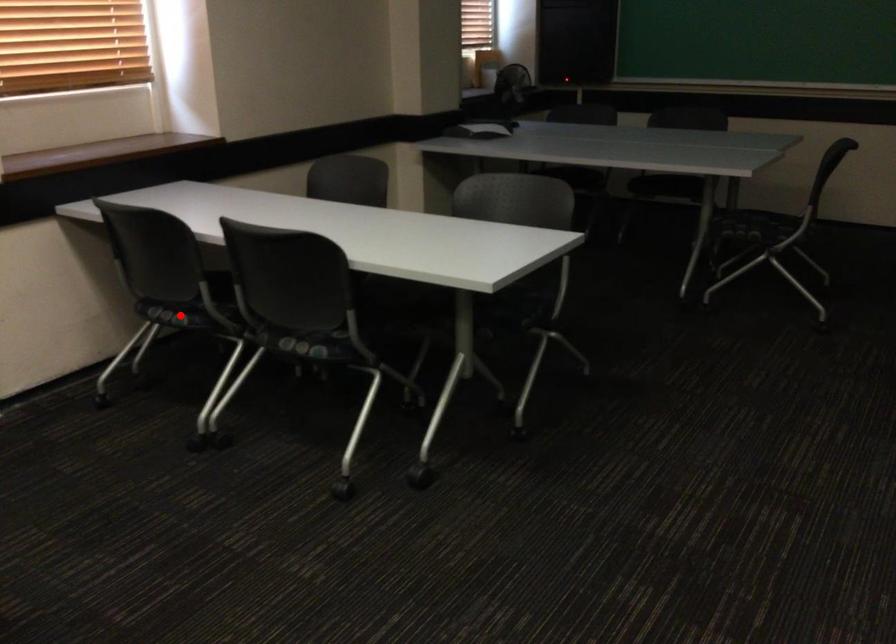
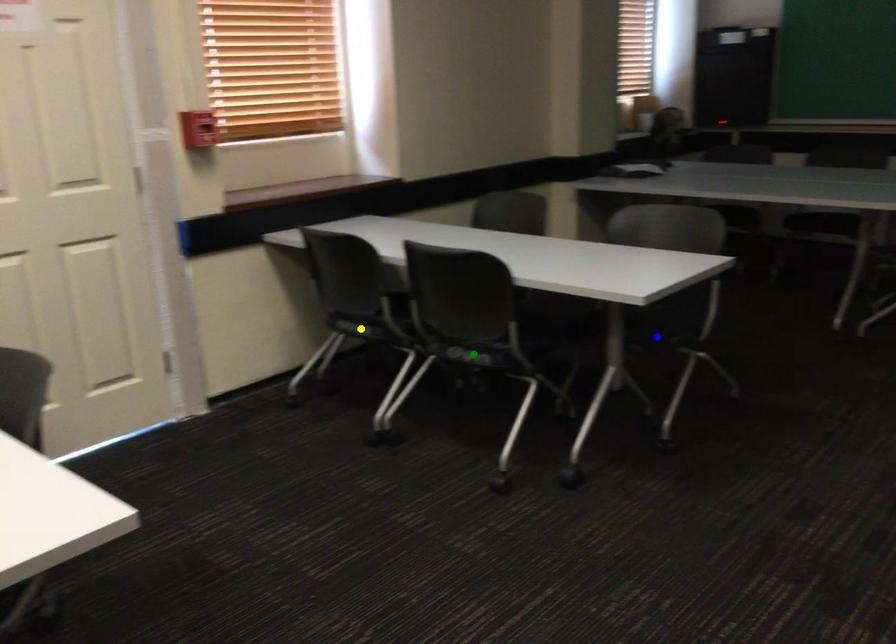
Question: I am providing you with two images of the same scene from different viewpoints. A red point is marked on the first image. You are given multiple points on the second image. Which spot in image 2 lines up with the point in image 1?

Choices:
 (A) yellow point
 (B) blue point
 (C) green point

Answer: (A)